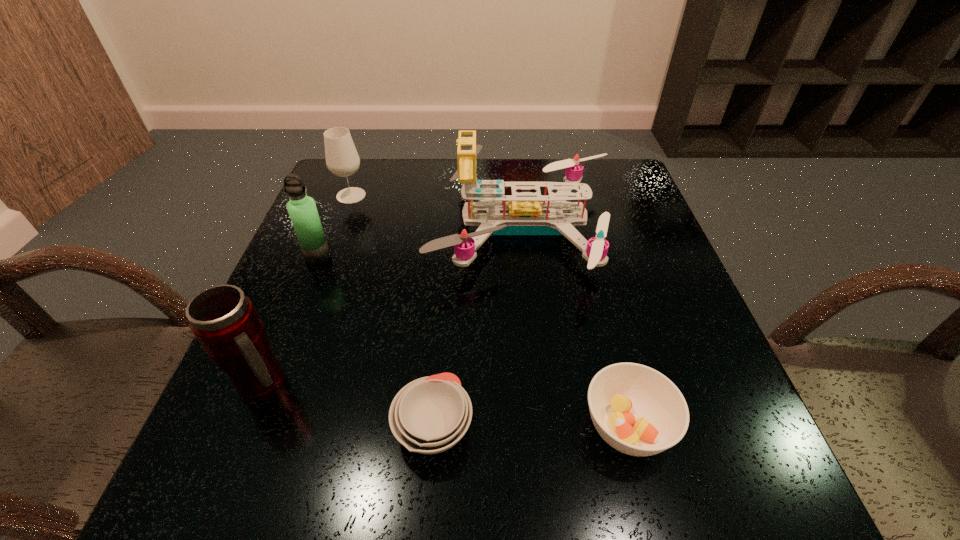
Locate an element on the screen. vacant region located 0.270m on the back of the farther thermos bottle is located at coordinates (347, 184).

The width and height of the screenshot is (960, 540). What are the coordinates of `vacant space located on the side with the handle of the nearer thermos bottle` in the screenshot? It's located at (493, 384).

Where is `free location located on the right of the glass`? free location located on the right of the glass is located at coordinates (462, 195).

At what (x,y) coordinates should I click in order to perform the action: click on vacant space located on the back of the right soup bowl. Please return your answer as a coordinate pair (x, y). This screenshot has width=960, height=540. Looking at the image, I should click on (587, 266).

Find the location of `vacant space located 0.290m on the back of the left soup bowl`. vacant space located 0.290m on the back of the left soup bowl is located at coordinates (446, 272).

Locate an element on the screen. drone at the far edge is located at coordinates (520, 215).

This screenshot has width=960, height=540. I want to click on glass located in the far edge section of the desktop, so click(x=342, y=159).

This screenshot has width=960, height=540. In order to click on glass that is at the left edge in this screenshot , I will do coord(342,159).

Locate an element on the screen. drone positioned at the right edge is located at coordinates coord(520,215).

Locate an element on the screen. soup bowl situated at the right edge is located at coordinates (638, 411).